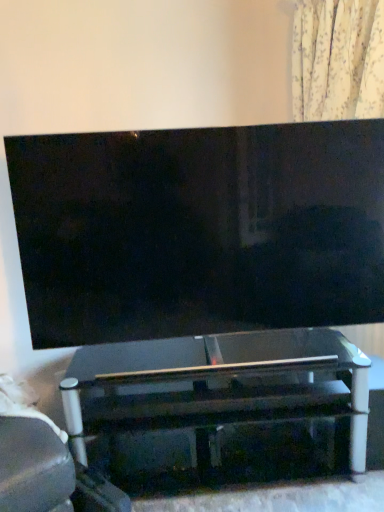
At what (x,y) coordinates should I click in order to perform the action: click on transparent glass table at center. Please return your answer as a coordinate pair (x, y). The width and height of the screenshot is (384, 512). Looking at the image, I should click on (215, 383).

Measure the distance between transparent glass table at center and camera.

transparent glass table at center and camera are 5.22 feet apart.

The image size is (384, 512). What do you see at coordinates (215, 383) in the screenshot?
I see `transparent glass table at center` at bounding box center [215, 383].

Describe the element at coordinates (199, 230) in the screenshot. I see `matte black tv at center` at that location.

Find the location of a particular element. The width and height of the screenshot is (384, 512). matte black tv at center is located at coordinates (199, 230).

What is the approximate width of matte black tv at center?

The width of matte black tv at center is 6.61 inches.

This screenshot has height=512, width=384. Identify the location of transparent glass table at center. (215, 383).

Between transparent glass table at center and matte black tv at center, which one appears on the left side from the viewer's perspective?

From the viewer's perspective, matte black tv at center appears more on the left side.

In the image, is transparent glass table at center positioned in front of or behind matte black tv at center?

In the image, transparent glass table at center appears behind matte black tv at center.

Which is closer, (x=344, y=383) or (x=331, y=163)?

→ Point (x=344, y=383) appears to be farther away from the viewer than point (x=331, y=163).

From the image's perspective, which is below, transparent glass table at center or matte black tv at center?

transparent glass table at center.

From a real-world perspective, which is physically below, transparent glass table at center or matte black tv at center?

In real-world perspective, transparent glass table at center is lower.

Looking at their sizes, would you say transparent glass table at center is wider or thinner than matte black tv at center?

Considering their sizes, transparent glass table at center looks broader than matte black tv at center.

Does transparent glass table at center have a greater height compared to matte black tv at center?

No.

Which of these two, transparent glass table at center or matte black tv at center, is bigger?

transparent glass table at center is bigger.

Is transparent glass table at center situated inside matte black tv at center or outside?

transparent glass table at center cannot be found inside matte black tv at center.

Are transparent glass table at center and matte black tv at center located far from each other?

transparent glass table at center is near matte black tv at center, not far away.

Is transparent glass table at center turned away from matte black tv at center?

No, transparent glass table at center's orientation is not away from matte black tv at center.

In the scene shown: How many degrees apart are the facing directions of transparent glass table at center and matte black tv at center?

The angle between the facing direction of transparent glass table at center and the facing direction of matte black tv at center is 0.474 degrees.

Find the location of a particular element. The image size is (384, 512). television in front of the transparent glass table at center is located at coordinates (199, 230).

Can you confirm if matte black tv at center is positioned to the right of transparent glass table at center?

In fact, matte black tv at center is to the left of transparent glass table at center.

Does matte black tv at center lie behind transparent glass table at center?

No, matte black tv at center is in front of transparent glass table at center.

Between point (213, 160) and point (150, 389), which one is positioned in front?

Positioned in front is point (213, 160).

Based on the photo, from the image's perspective, would you say matte black tv at center is positioned over transparent glass table at center?

Yes, from the image's perspective, matte black tv at center is above transparent glass table at center.

From a real-world perspective, who is located lower, matte black tv at center or transparent glass table at center?

From a 3D spatial view, transparent glass table at center is below.

Considering the sizes of objects matte black tv at center and transparent glass table at center in the image provided, who is thinner, matte black tv at center or transparent glass table at center?

Thinner between the two is matte black tv at center.

In the scene shown: From their relative heights in the image, would you say matte black tv at center is taller or shorter than transparent glass table at center?

Considering their sizes, matte black tv at center has more height than transparent glass table at center.

Between matte black tv at center and transparent glass table at center, which one has larger size?

transparent glass table at center.

Is transparent glass table at center located within matte black tv at center?

No, transparent glass table at center is not surrounded by matte black tv at center.

Consider the image. Is matte black tv at center positioned far away from transparent glass table at center?

No.

Is matte black tv at center oriented away from transparent glass table at center?

No, matte black tv at center's orientation is not away from transparent glass table at center.

Identify the location of television that appears above the transparent glass table at center (from a real-world perspective). (199, 230).

The image size is (384, 512). Identify the location of television located on the left of transparent glass table at center. (199, 230).

You are a GUI agent. You are given a task and a screenshot of the screen. Output one action in this format:
    pyautogui.click(x=<x>, y=<y>)
    Task: Click on the table located underneath the matte black tv at center (from a real-world perspective)
    The width and height of the screenshot is (384, 512).
    Given the screenshot: What is the action you would take?
    pyautogui.click(x=215, y=383)